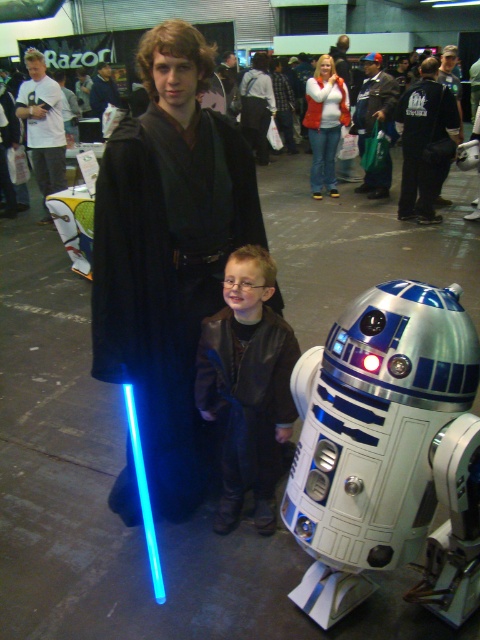
You are organizing a photo shoot in the convention hall and need to place a large camera tripod exactly where the leather jacket at center was. What coordinates should you use to set up the tripod?

The leather jacket at center was positioned at coordinates point (248, 387), so you should set up the tripod there.

You are a photographer positioned at the back of the convention hall. You need to take a photo that includes both the leather jacket at center and the smooth black robe at center. Which object will appear larger in your photo?

The leather jacket at center will appear larger in the photo because it is closer to the viewer than the smooth black robe at center.

You are organizing a costume party and need to ensure that all costumes fit through a narrow doorway. The doorway is exactly 1 meter wide. You have two costumes to check for clearance. The first is the black matte robe at center, and the second is the dark blue jeans at center. Based on the image, which costume has a wider width and will require more caution when moving through the doorway?

The black matte robe at center has a larger width than the dark blue jeans at center, so it will require more caution when moving through the doorway since it is wider.